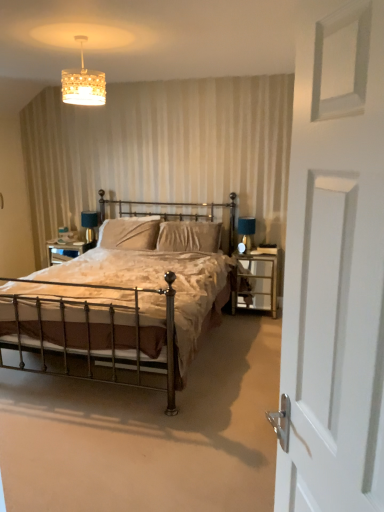
Find the location of a particular element. The image size is (384, 512). vacant space underneath matte blue glass table lamp at right (from a real-world perspective) is located at coordinates (255, 246).